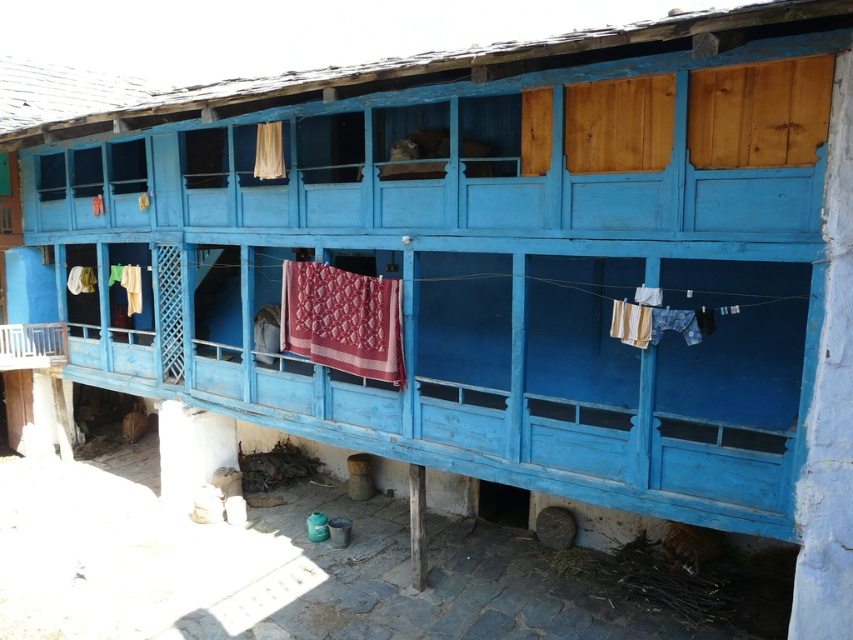
Question: Among these objects, which one is nearest to the camera?

Choices:
 (A) quilted fabric at center
 (B) wooden balcony at lower left
 (C) matte white curtain at upper center

Answer: (A)

Question: Among these objects, which one is nearest to the camera?

Choices:
 (A) wooden balcony at lower left
 (B) matte white curtain at upper center

Answer: (B)

Question: Is quilted fabric at center thinner than wooden balcony at lower left?

Choices:
 (A) yes
 (B) no

Answer: (B)

Question: Is wooden balcony at lower left thinner than matte white curtain at upper center?

Choices:
 (A) no
 (B) yes

Answer: (A)

Question: Which object is closer to the camera taking this photo?

Choices:
 (A) quilted fabric at center
 (B) wooden balcony at lower left

Answer: (A)

Question: Does quilted fabric at center have a smaller size compared to wooden balcony at lower left?

Choices:
 (A) yes
 (B) no

Answer: (B)